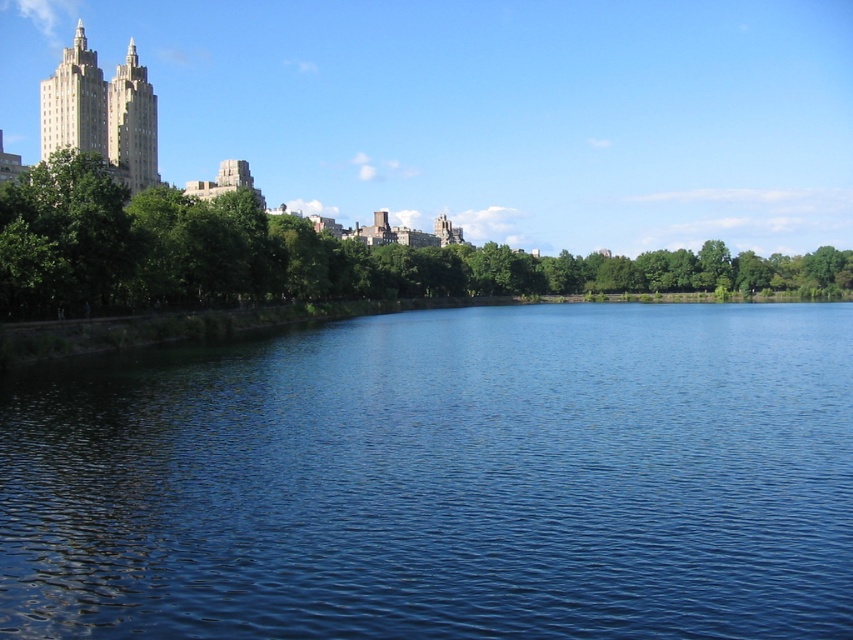
Does green leafy trees at upper left appear on the left side of gold textured building at upper left?

No, green leafy trees at upper left is not to the left of gold textured building at upper left.

Is point (410, 273) positioned after point (120, 109)?

Yes, point (410, 273) is farther from viewer.

What do you see at coordinates (299, 256) in the screenshot? I see `green leafy trees at upper left` at bounding box center [299, 256].

Where is `green leafy trees at upper left`? This screenshot has height=640, width=853. green leafy trees at upper left is located at coordinates (299, 256).

Between blue liquid at center and gold textured building at upper left, which one appears on the right side from the viewer's perspective?

blue liquid at center

Who is taller, blue liquid at center or gold textured building at upper left?

With more height is gold textured building at upper left.

Who is more distant from viewer, (836,378) or (129,49)?

Positioned behind is point (129,49).

This screenshot has width=853, height=640. I want to click on blue liquid at center, so pos(442,480).

The image size is (853, 640). Identify the location of blue liquid at center. (442, 480).

Does point (674, 516) lie in front of point (544, 264)?

Yes, it is in front of point (544, 264).

Where is `blue liquid at center`? blue liquid at center is located at coordinates (442, 480).

This screenshot has height=640, width=853. What are the coordinates of `blue liquid at center` in the screenshot? It's located at (442, 480).